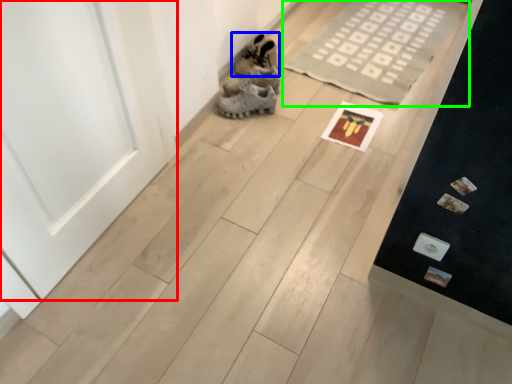
Question: Based on their relative distances, which object is farther from door (highlighted by a red box)? Choose from footwear (highlighted by a blue box) and doormat (highlighted by a green box).

Choices:
 (A) footwear
 (B) doormat

Answer: (B)